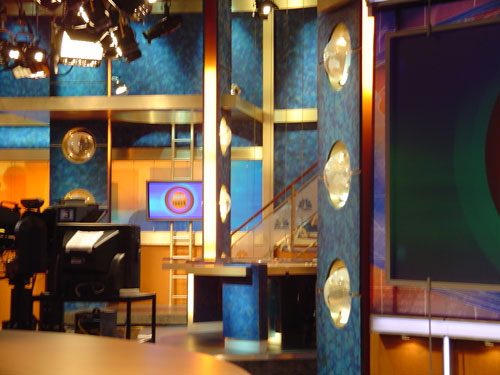
I want to click on monitor, so click(x=157, y=194).